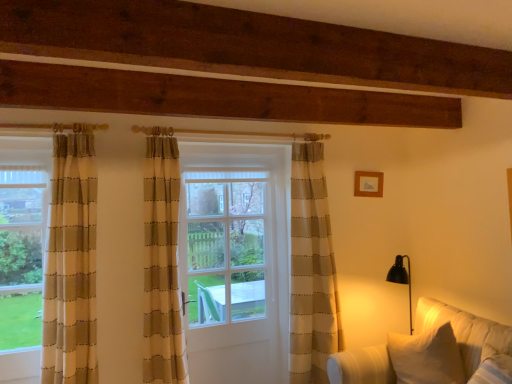
The image size is (512, 384). Find the location of `empty space that is ontop of beige striped curtains at left (from a real-world perspective)`. empty space that is ontop of beige striped curtains at left (from a real-world perspective) is located at coordinates (24, 157).